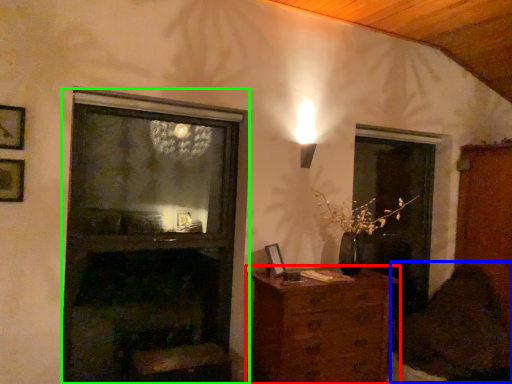
Question: Which is farther away from chest of drawers (highlighted by a red box)? swivel chair (highlighted by a blue box) or fireplace (highlighted by a green box)?

Choices:
 (A) swivel chair
 (B) fireplace

Answer: (A)